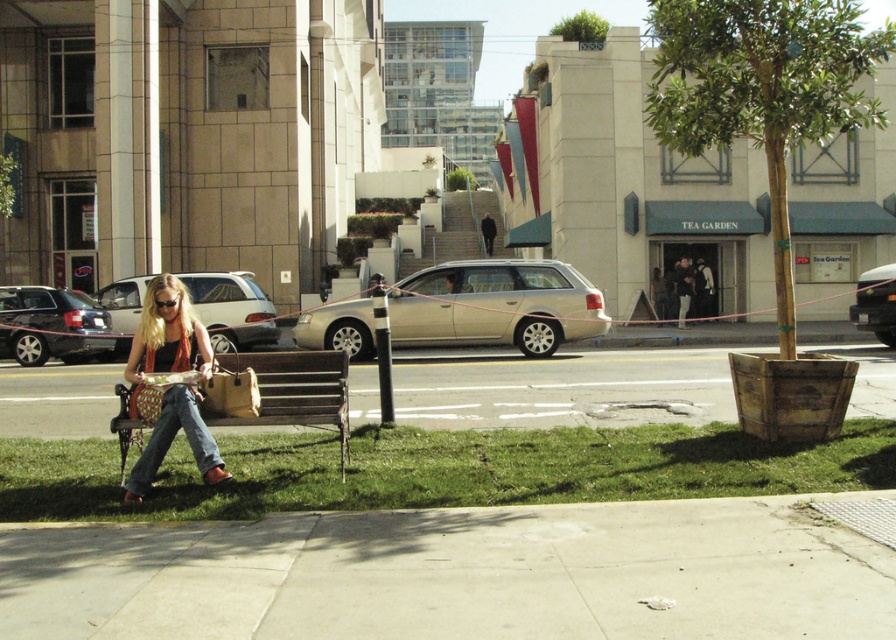
You are a delivery person trying to park your 2.5 meters wide van between the satin gold station wagon at center and the denim at lower left. Can your van fit in the space between them?

The satin gold station wagon at center is wider than the denim at lower left. However, the exact width of the space between them isn not provided, so it is uncertain if the 2.5 meters wide van can fit.

Looking at this image, you are a delivery person trying to navigate through the street. You see the satin gold station wagon at center and the denim at lower left. Which object is taller and might block your path?

The satin gold station wagon at center is much taller than the denim at lower left, so it might block your path.

You are a delivery person trying to navigate through the street. You see the matte black sedan at left and the denim at lower left. Which object is taller and could potentially block your path?

The matte black sedan at left is taller than the denim at lower left, so it could potentially block your path.